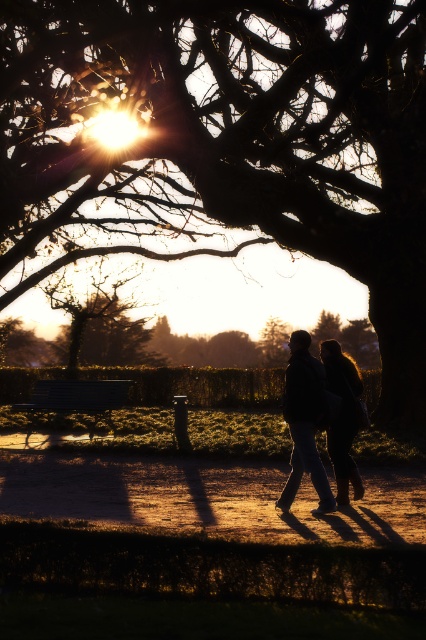
Question: Which object is closer to the camera taking this photo?

Choices:
 (A) brown textured tree at upper center
 (B) dark blue jeans at center

Answer: (B)

Question: Considering the real-world distances, which object is closest to the metallic silver bench at lower left?

Choices:
 (A) dirt path at center
 (B) dark blue jeans at center

Answer: (B)

Question: Is brown textured tree at upper center wider than silky black hair at center?

Choices:
 (A) yes
 (B) no

Answer: (A)

Question: Can you confirm if silky black hair at center is thinner than metallic silver bench at lower left?

Choices:
 (A) no
 (B) yes

Answer: (B)

Question: Is dirt path at center smaller than metallic silver bench at lower left?

Choices:
 (A) no
 (B) yes

Answer: (B)

Question: Estimate the real-world distances between objects in this image. Which object is farther from the metallic silver bench at lower left?

Choices:
 (A) silky black hair at center
 (B) dark blue jeans at center
 (C) brown textured tree at upper center

Answer: (B)